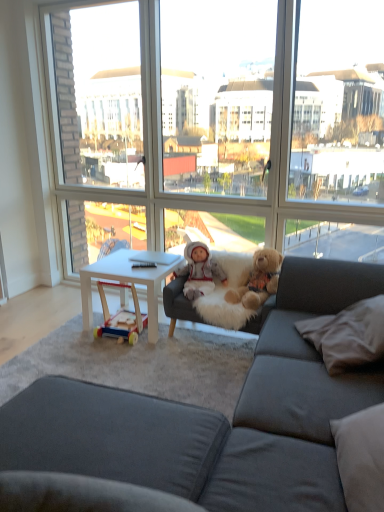
Question: Considering the positions of fluffy brown teddy bear at center and transparent glass window at center in the image, is fluffy brown teddy bear at center wider or thinner than transparent glass window at center?

Choices:
 (A) thin
 (B) wide

Answer: (B)

Question: From the image's perspective, is fluffy brown teddy bear at center located above or below transparent glass window at center?

Choices:
 (A) below
 (B) above

Answer: (A)

Question: Considering the real-world distances, which object is farthest from the fluffy brown teddy bear at center?

Choices:
 (A) white soft pillow at lower right
 (B) white plush doll at center
 (C) transparent glass window at center
 (D) dark gray fabric couch at center
 (E) white matte table at center

Answer: (D)

Question: Estimate the real-world distances between objects in this image. Which object is farther from the white soft pillow at lower right?

Choices:
 (A) white plush doll at center
 (B) white matte table at center
 (C) fluffy brown teddy bear at center
 (D) dark gray fabric couch at center
 (E) transparent glass window at center

Answer: (E)